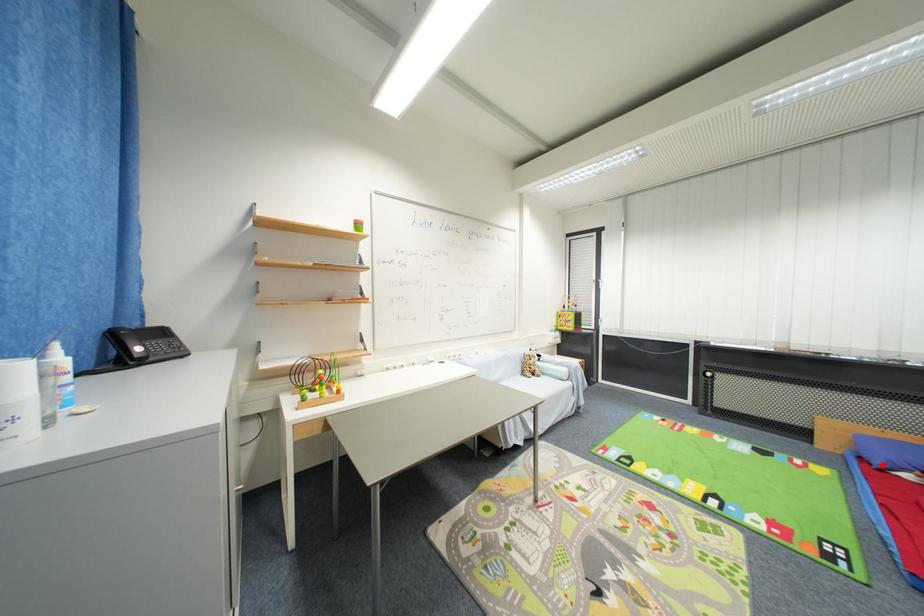
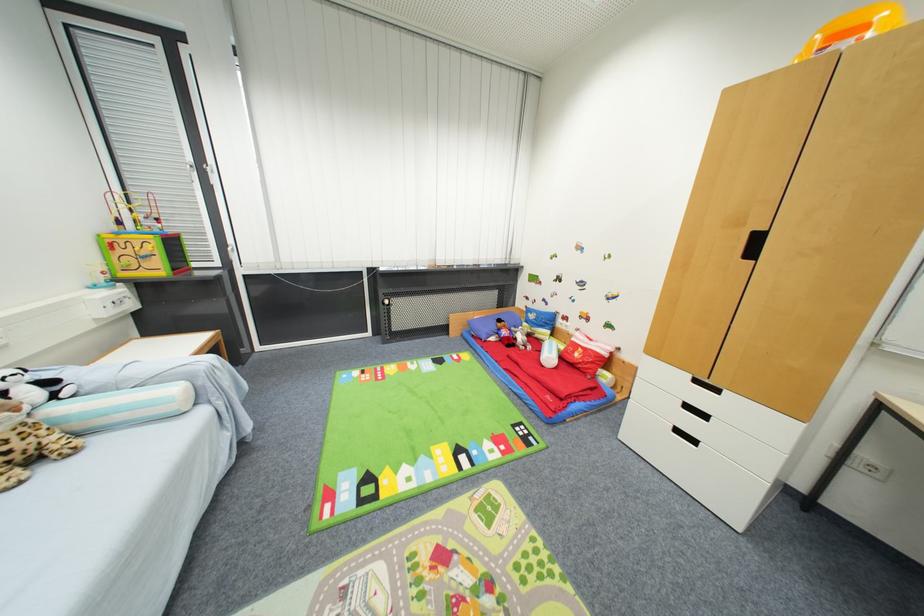
Where in the second image is the point corresponding to the highlighted location from the first image?

(488, 339)